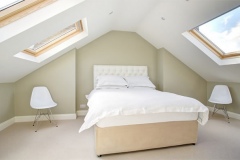
Find the location of a particular element. The width and height of the screenshot is (240, 160). sky light is located at coordinates (233, 37), (56, 51), (16, 18).